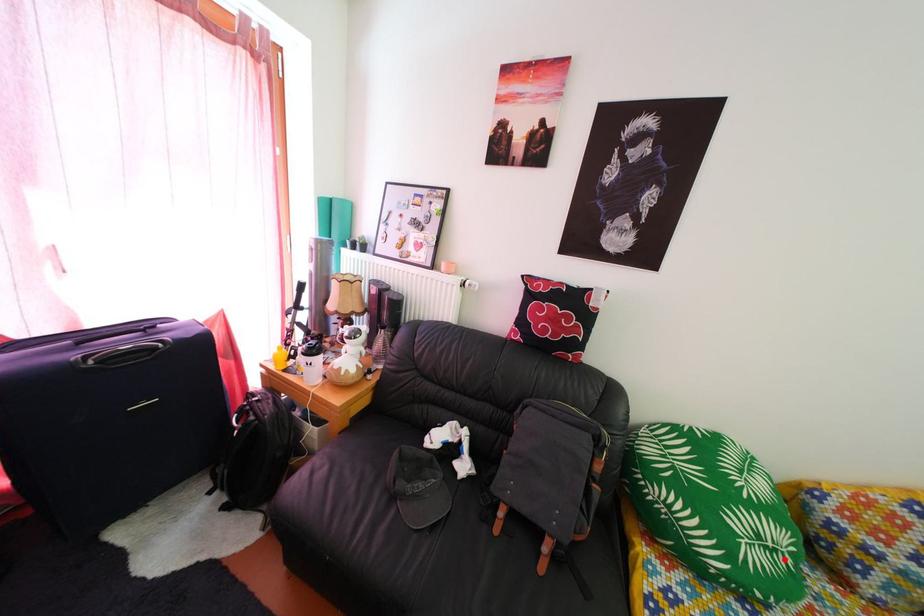
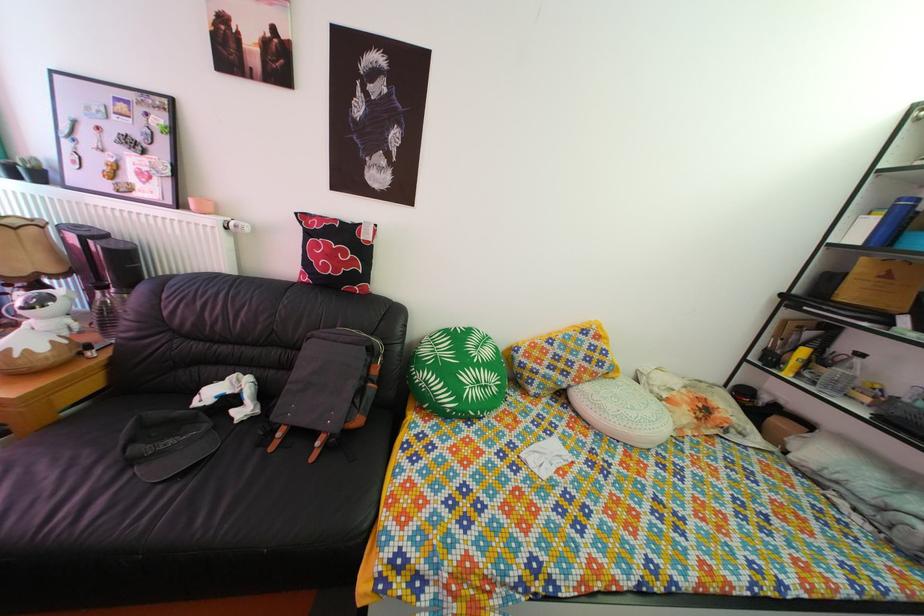
Question: I am providing you with two images of the same scene from different viewpoints. A red point is shown in image1. For the corresponding object point in image2, is it positioned nearer or farther from the camera?

Choices:
 (A) Nearer
 (B) Farther

Answer: (B)